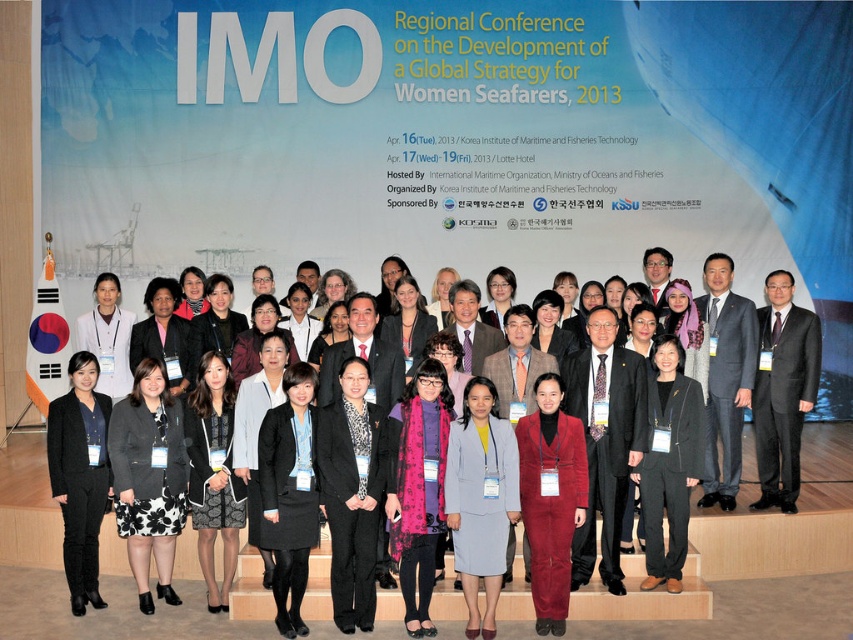
You are a photographer standing at the back of the conference hall. You want to take a photo of both the black suit at center and the black suit at lower left. Given that your camera has a maximum focus range of 80 feet, will you be able to capture both subjects in focus without moving closer?

The black suit at center and black suit at lower left are 81.77 feet apart from each other, which exceeds the camera maximum focus range of 80 feet. Therefore, you cannot capture both subjects in focus without moving closer.

You are attending the Regional Conference on the Development of a Global Strategy for Women Seafarers in 2013. You notice two attendees dressed in a black floral dress at lower left and a dark gray suit at right. Which attendee is shorter?

The black floral dress at lower left has a lesser height compared to dark gray suit at right, so the attendee in the black floral dress at lower left is shorter.

You are a photographer at the Regional Conference on the Development of a Global Strategy for Women Seafarers in 2013. You notice two attendees wearing a black floral dress at lower left and a dark gray suit at right. Which attendee is wearing a thinner garment?

The black floral dress at lower left is thinner than the dark gray suit at right, so the attendee wearing the black floral dress at lower left has a thinner garment.